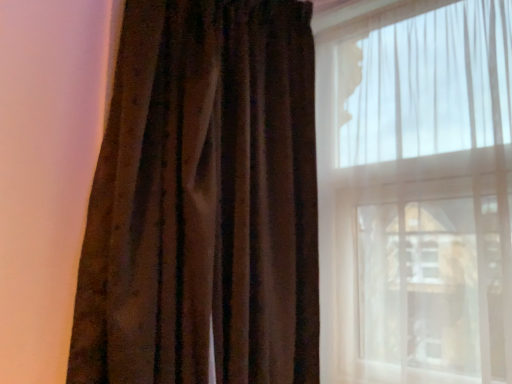
Describe the element at coordinates (416, 194) in the screenshot. The height and width of the screenshot is (384, 512). I see `translucent white curtain at right` at that location.

You are a GUI agent. You are given a task and a screenshot of the screen. Output one action in this format:
    pyautogui.click(x=<x>, y=<y>)
    Task: Click on the translucent white curtain at right
    This screenshot has height=384, width=512.
    Given the screenshot: What is the action you would take?
    pyautogui.click(x=416, y=194)

The image size is (512, 384). Describe the element at coordinates (204, 201) in the screenshot. I see `velvet brown curtain at left` at that location.

Locate an element on the screen. The height and width of the screenshot is (384, 512). velvet brown curtain at left is located at coordinates (204, 201).

What are the coordinates of `translucent white curtain at right` in the screenshot? It's located at (416, 194).

Looking at this image, between translucent white curtain at right and velvet brown curtain at left, which one appears on the left side from the viewer's perspective?

velvet brown curtain at left.

From the picture: Which object is closer to the camera, translucent white curtain at right or velvet brown curtain at left?

velvet brown curtain at left.

Is point (482, 91) closer to viewer compared to point (298, 33)?

Yes, it is in front of point (298, 33).

From the image's perspective, is translucent white curtain at right positioned above or below velvet brown curtain at left?

From the image's perspective, translucent white curtain at right appears below velvet brown curtain at left.

From a real-world perspective, is translucent white curtain at right located higher than velvet brown curtain at left?

Incorrect, from a real-world perspective, translucent white curtain at right is lower than velvet brown curtain at left.

Looking at their sizes, would you say translucent white curtain at right is wider or thinner than velvet brown curtain at left?

In the image, translucent white curtain at right appears to be more narrow than velvet brown curtain at left.

Considering the sizes of translucent white curtain at right and velvet brown curtain at left in the image, is translucent white curtain at right taller or shorter than velvet brown curtain at left?

translucent white curtain at right is shorter than velvet brown curtain at left.

Looking at the image, does translucent white curtain at right seem bigger or smaller compared to velvet brown curtain at left?

translucent white curtain at right is smaller than velvet brown curtain at left.

Is translucent white curtain at right spatially inside velvet brown curtain at left, or outside of it?

translucent white curtain at right is spatially situated outside velvet brown curtain at left.

Is translucent white curtain at right far from velvet brown curtain at left?

translucent white curtain at right is actually quite close to velvet brown curtain at left.

Is translucent white curtain at right looking in the opposite direction of velvet brown curtain at left?

That's not correct — translucent white curtain at right is not looking away from velvet brown curtain at left.

Identify the location of window behind the velvet brown curtain at left. (416, 194).

Between velvet brown curtain at left and translucent white curtain at right, which one appears on the right side from the viewer's perspective?

translucent white curtain at right.

Which object is closer to the camera, velvet brown curtain at left or translucent white curtain at right?

velvet brown curtain at left is in front.

Does point (266, 241) lie in front of point (365, 367)?

Yes.

Consider the image. From the image's perspective, which object appears higher, velvet brown curtain at left or translucent white curtain at right?

velvet brown curtain at left.

From a real-world perspective, is velvet brown curtain at left located beneath translucent white curtain at right?

No, from a real-world perspective, velvet brown curtain at left is not below translucent white curtain at right.

Consider the image. Which of these two, velvet brown curtain at left or translucent white curtain at right, is thinner?

translucent white curtain at right.

Does velvet brown curtain at left have a greater height compared to translucent white curtain at right?

Yes.

Is velvet brown curtain at left smaller than translucent white curtain at right?

Actually, velvet brown curtain at left might be larger than translucent white curtain at right.

Would you say velvet brown curtain at left is outside translucent white curtain at right?

velvet brown curtain at left lies outside translucent white curtain at right's area.

Can you see velvet brown curtain at left touching translucent white curtain at right?

velvet brown curtain at left and translucent white curtain at right are clearly separated.

Does velvet brown curtain at left turn towards translucent white curtain at right?

No, velvet brown curtain at left is not oriented towards translucent white curtain at right.

Locate an element on the screen. The width and height of the screenshot is (512, 384). curtain lying on the left of translucent white curtain at right is located at coordinates (204, 201).

You are a GUI agent. You are given a task and a screenshot of the screen. Output one action in this format:
    pyautogui.click(x=<x>, y=<y>)
    Task: Click on the curtain above the translucent white curtain at right (from the image's perspective)
    
    Given the screenshot: What is the action you would take?
    pyautogui.click(x=204, y=201)

This screenshot has width=512, height=384. What are the coordinates of `window that appears behind the velvet brown curtain at left` in the screenshot? It's located at (416, 194).